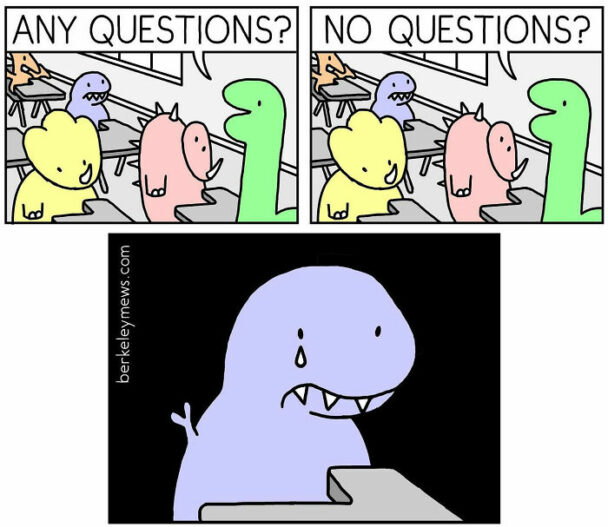
Where is `wall`? This screenshot has height=527, width=608. wall is located at coordinates (498, 94), (208, 92).